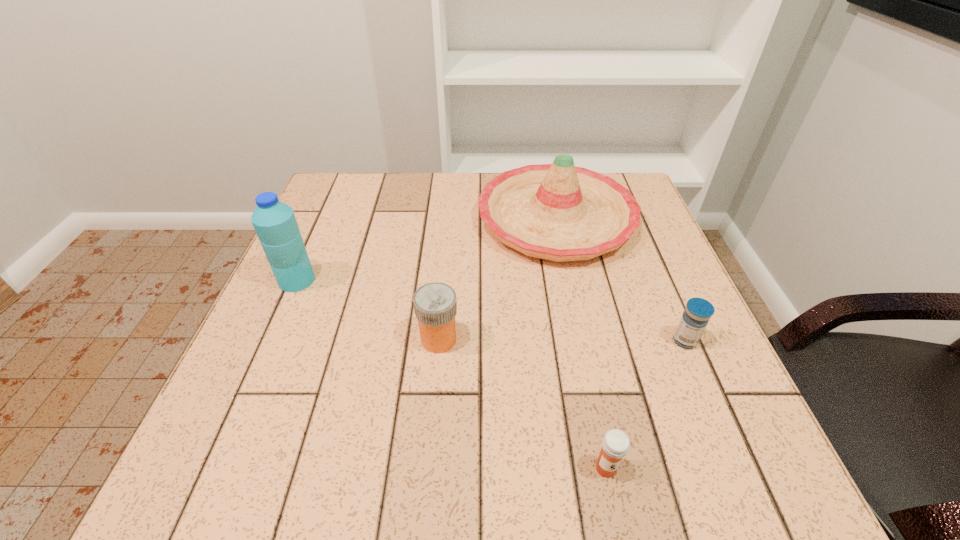
Where is `the tallest object`? the tallest object is located at coordinates (274, 221).

Identify the location of water bottle. Image resolution: width=960 pixels, height=540 pixels. (274, 221).

Locate an element on the screen. The height and width of the screenshot is (540, 960). the fourth shortest object is located at coordinates (558, 212).

Locate an element on the screen. This screenshot has width=960, height=540. the third tallest object is located at coordinates (435, 304).

What are the coordinates of `the fourth object from right to left` in the screenshot? It's located at 435,304.

You are a GUI agent. You are given a task and a screenshot of the screen. Output one action in this format:
    pyautogui.click(x=<x>, y=<y>)
    Task: Click on the rightmost medicine
    
    Given the screenshot: What is the action you would take?
    pyautogui.click(x=698, y=311)

This screenshot has height=540, width=960. I want to click on the nearest medicine, so click(615, 444).

I want to click on the nearest object, so click(615, 444).

Where is `vacant space located 0.140m on the back of the leftmost object`? Image resolution: width=960 pixels, height=540 pixels. vacant space located 0.140m on the back of the leftmost object is located at coordinates (319, 231).

You are a GUI agent. You are given a task and a screenshot of the screen. Output one action in this format:
    pyautogui.click(x=<x>, y=<y>)
    Task: Click on the vacant space positioned 0.400m on the front of the fourth shortest object
    Image resolution: width=960 pixels, height=540 pixels.
    Given the screenshot: What is the action you would take?
    pyautogui.click(x=604, y=444)